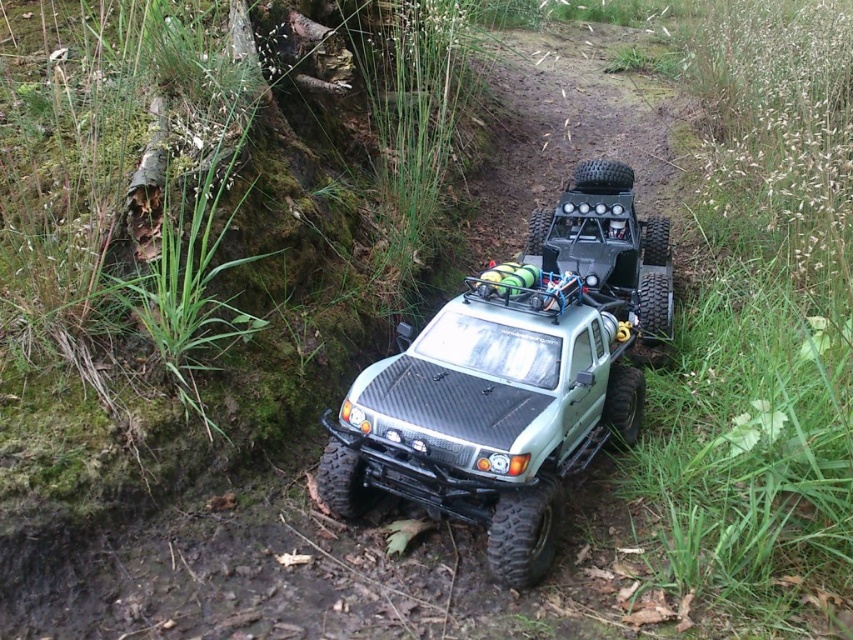
You are an RC car enthusiast who wants to race your green matte truck at center and matte black jeep at center on the muddy trail. Since both vehicles are at the center, which one should you start moving first to avoid collision?

The green matte truck at center is to the left of the matte black jeep at center. To avoid collision, you should start moving the green matte truck at center first since it is positioned to the left and can move out of the central area before the matte black jeep at center.

You are a driver planning to navigate through a narrow muddy path in this scene. You have two vehicles available, the green matte truck at center and the matte black jeep at center. Which vehicle would you choose to ensure it fits through the path without getting stuck?

The matte black jeep at center has a narrower width compared to the green matte truck at center, so choosing the matte black jeep at center would be more suitable for navigating the narrow muddy path without getting stuck.

In the scene shown: You are a RC car enthusiast who wants to race your green matte truck at center and matte black jeep at center on the muddy trail. Since both vehicles are at the center, can you determine which one is positioned lower on the trail?

The green matte truck at center is located below matte black jeep at center, so the green matte truck at center is positioned lower on the trail.